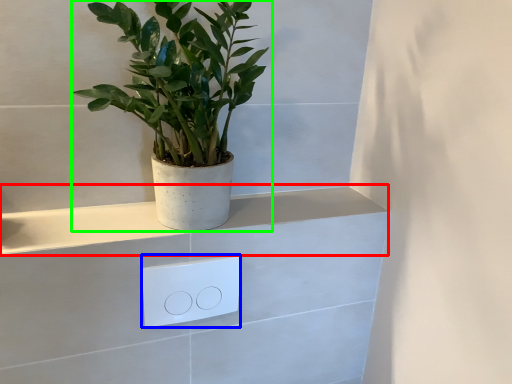
Question: Based on their relative distances, which object is nearer to ledge (highlighted by a red box)? Choose from light switch (highlighted by a blue box) and houseplant (highlighted by a green box).

Choices:
 (A) light switch
 (B) houseplant

Answer: (A)